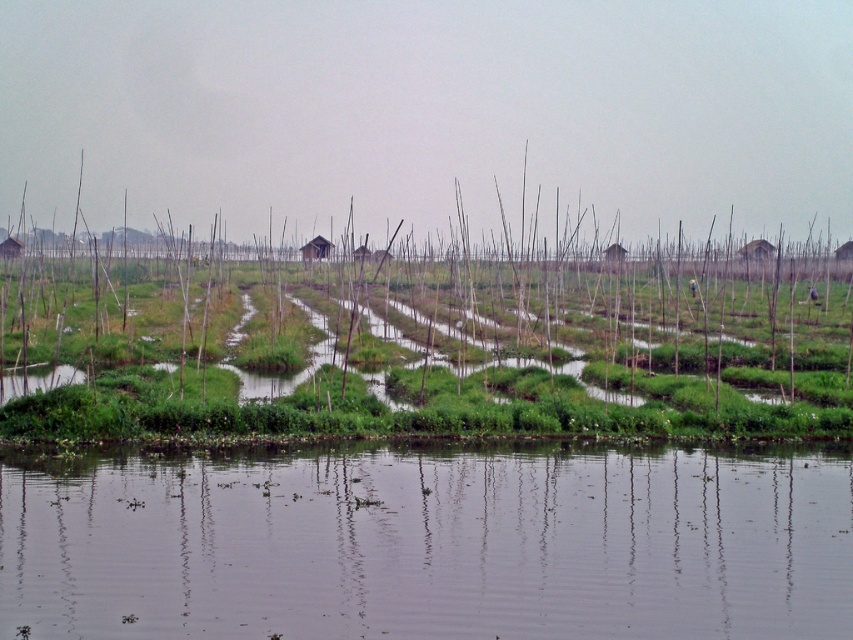
Does clear water at lower center appear over green grassy reed at center?

Incorrect, clear water at lower center is not positioned above green grassy reed at center.

Does clear water at lower center have a larger size compared to green grassy reed at center?

No.

Is point (627, 564) farther from camera compared to point (750, 300)?

No, (627, 564) is closer to viewer.

The height and width of the screenshot is (640, 853). I want to click on clear water at lower center, so click(430, 547).